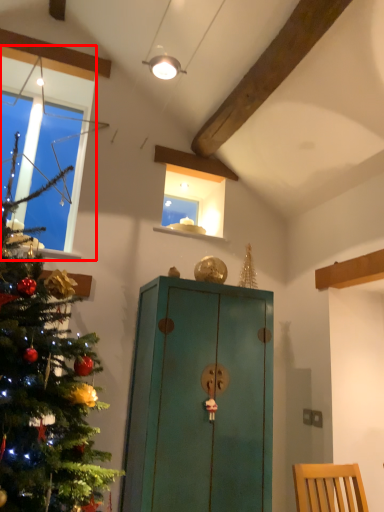
Question: From the image, what is the correct spatial relationship of window (annotated by the red box) in relation to cabinetry?

Choices:
 (A) left
 (B) right

Answer: (A)